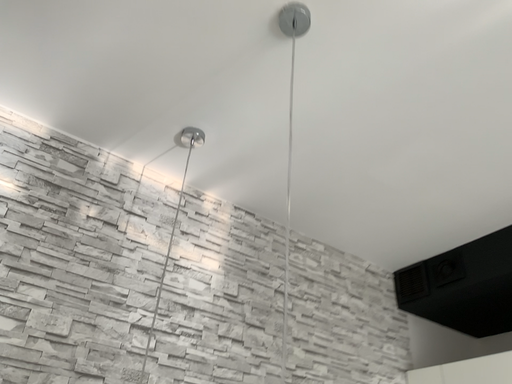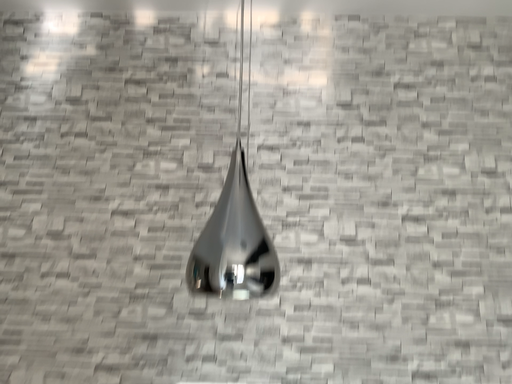
Question: How did the camera likely rotate when shooting the video?

Choices:
 (A) rotated left
 (B) rotated right

Answer: (A)